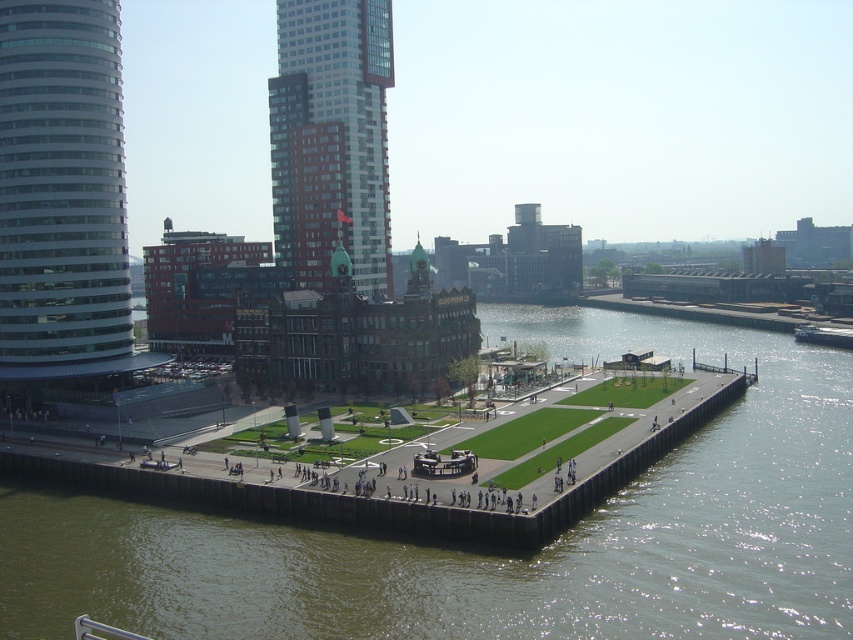
From the picture: Is glassy steel tower at left bigger than red brick building at center?

Actually, glassy steel tower at left might be smaller than red brick building at center.

Between glassy steel tower at left and red brick building at center, which one is positioned lower?

glassy steel tower at left is below.

The width and height of the screenshot is (853, 640). What do you see at coordinates (62, 193) in the screenshot? I see `glassy steel tower at left` at bounding box center [62, 193].

What are the coordinates of `glassy steel tower at left` in the screenshot? It's located at (62, 193).

Between green concrete river at lower center and glassy steel tower at left, which one is positioned lower?

Positioned lower is green concrete river at lower center.

I want to click on green concrete river at lower center, so click(x=500, y=557).

Locate an element on the screen. The height and width of the screenshot is (640, 853). green concrete river at lower center is located at coordinates (500, 557).

This screenshot has height=640, width=853. Find the location of `green concrete river at lower center`. green concrete river at lower center is located at coordinates (500, 557).

Does green concrete river at lower center have a smaller size compared to red brick building at center?

Incorrect, green concrete river at lower center is not smaller in size than red brick building at center.

Who is more forward, (695, 556) or (312, 17)?

Point (695, 556) is in front.

Is point (38, 557) closer to viewer compared to point (363, 282)?

Yes, it is.

Locate an element on the screen. The image size is (853, 640). green concrete river at lower center is located at coordinates (500, 557).